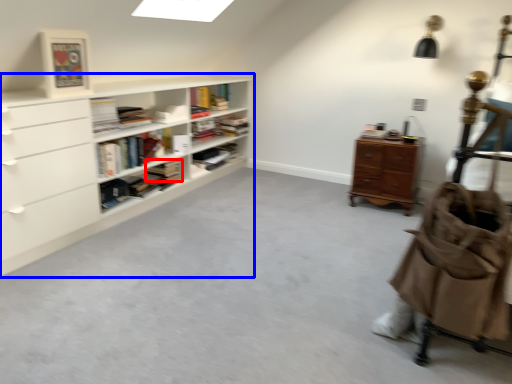
Question: Which point is closer to the camera, book (highlighted by a red box) or shelf (highlighted by a blue box)?

Choices:
 (A) book
 (B) shelf

Answer: (B)